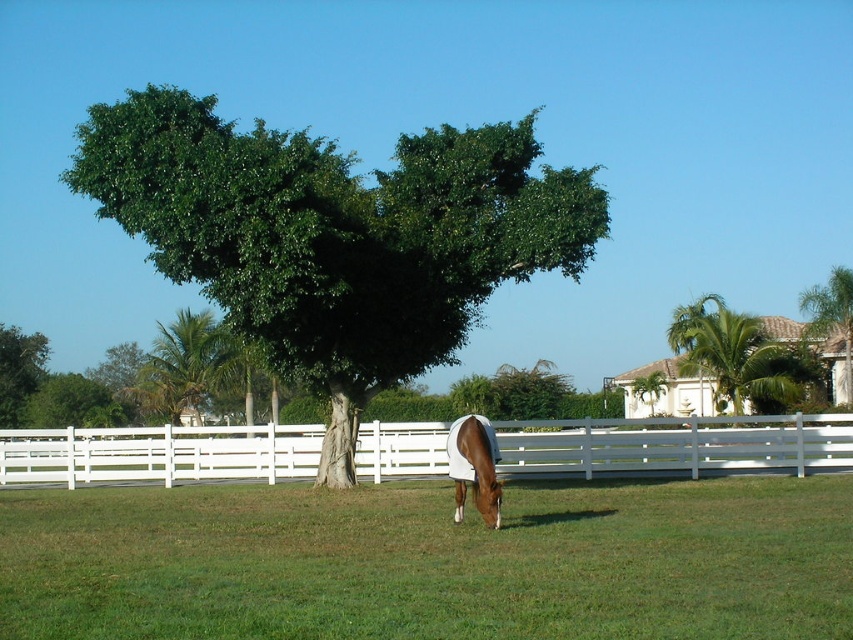
You are standing in the middle of the lawn and want to walk towards the tree that is wider. Which tree should you head towards, the green leafy tree at center or the green leafy tree at left?

The green leafy tree at center is wider than the green leafy tree at left, so you should head towards the green leafy tree at center.

You are planning to install a fence between the green leafy tree at center and the green leafy palm tree at upper right. What is the minimum length of the fence needed to separate them?

The minimum length of the fence needed to separate the green leafy tree at center and the green leafy palm tree at upper right is 21.10 meters, which is the distance between them.

You are planning to set up a picnic blanket between the green leafy tree at center and the green leafy tree at left. The picnic blanket is 10 feet wide. Will there be enough space between the two trees to place the blanket without it overlapping either tree?

The green leafy tree at center and green leafy tree at left are 102.62 feet apart from each other. Since the picnic blanket is only 10 feet wide, there is more than enough space between the two trees to place the blanket without overlapping either tree.